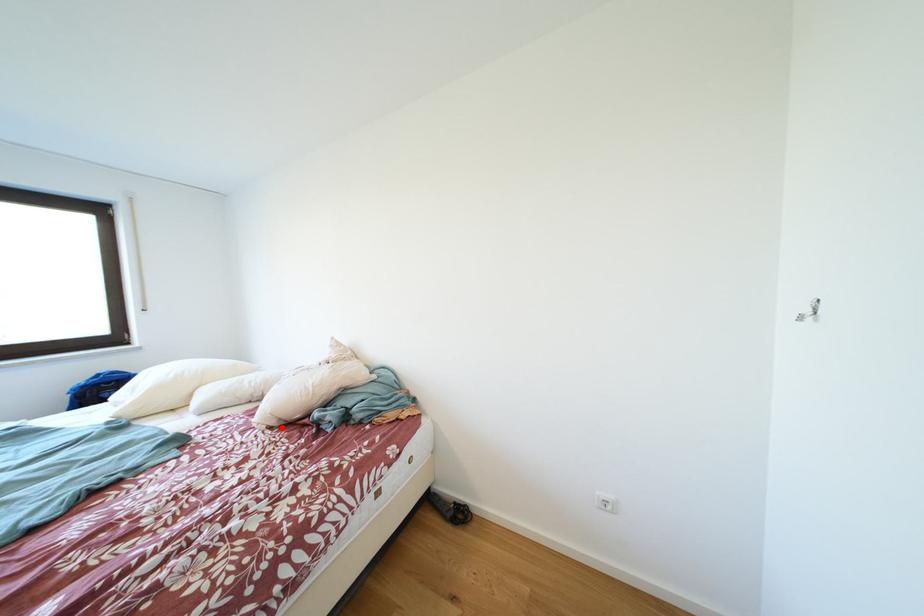
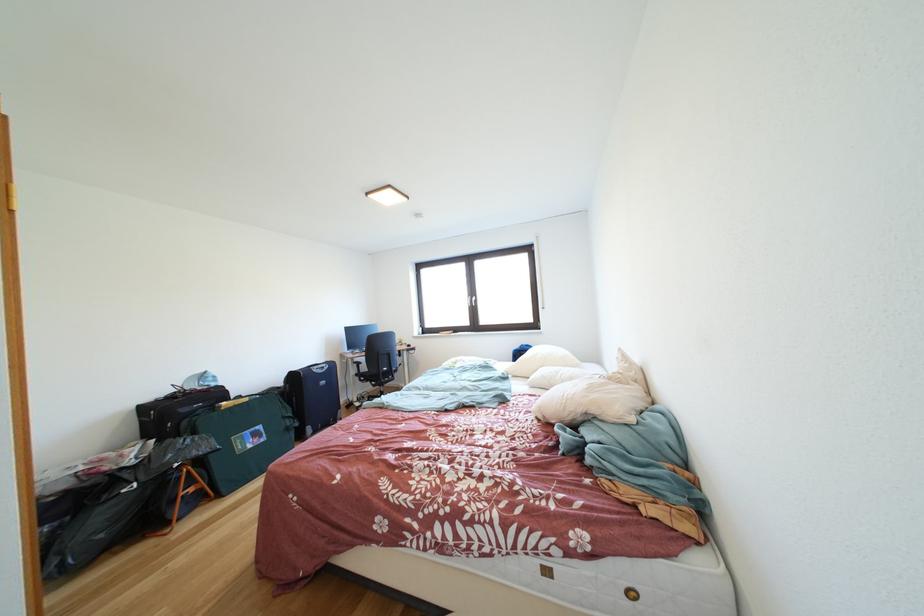
In the second image, find the point that corresponds to the highlighted location in the first image.

(549, 421)